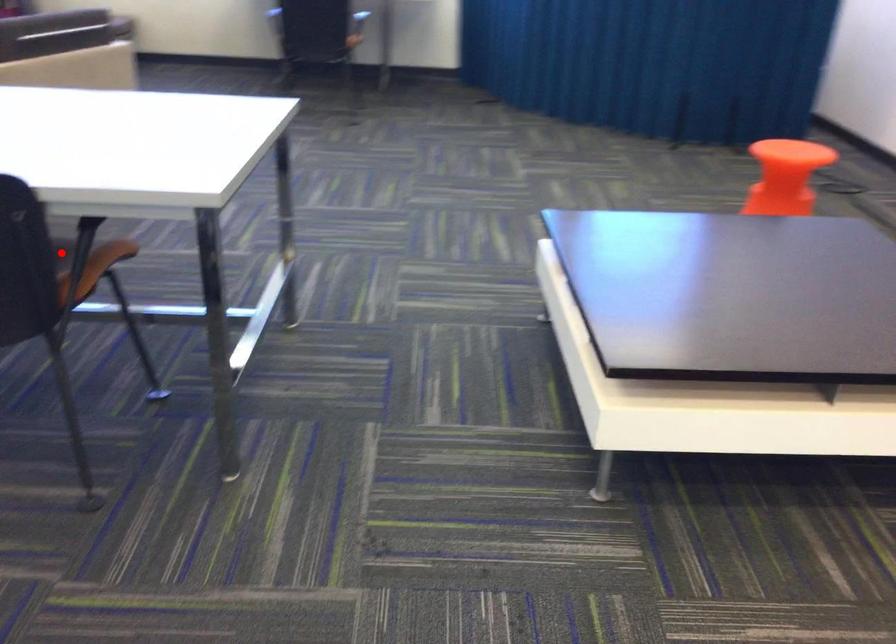
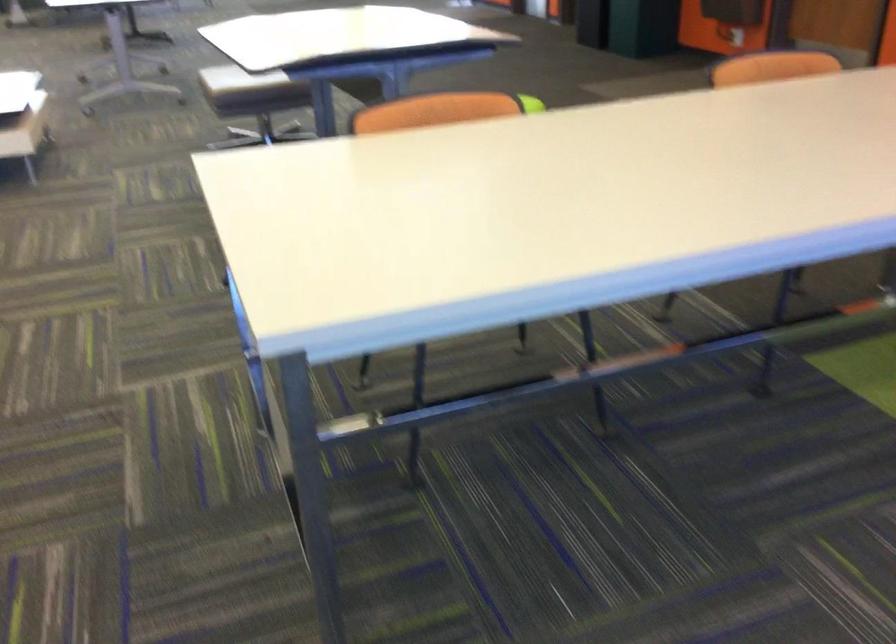
Question: I am providing you with two images of the same scene from different viewpoints. A red point is marked on the first image. Is the red point's position out of view in image 2?

Choices:
 (A) Yes
 (B) No

Answer: (A)